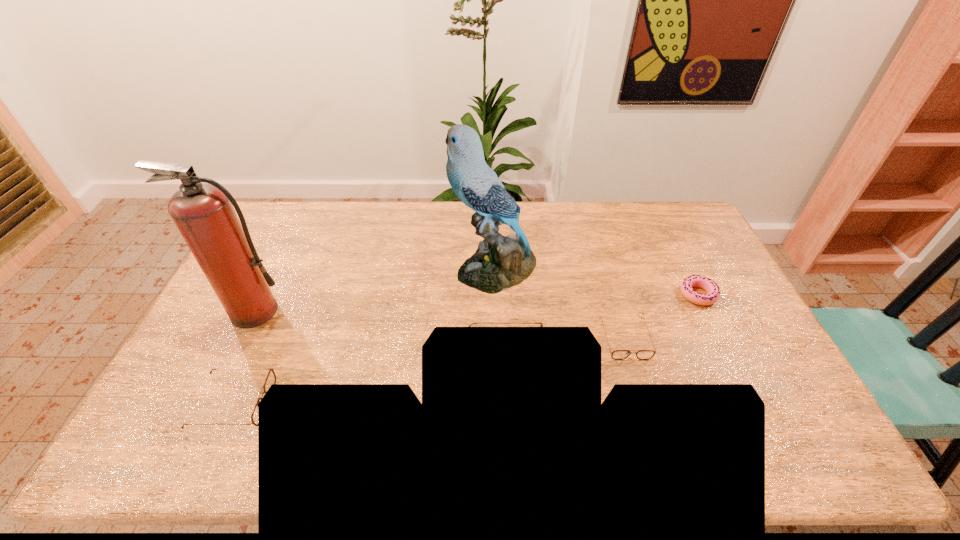
The height and width of the screenshot is (540, 960). Find the location of `vacant space that satisfies the following two spatial constraints: 1. on the front-facing side of the rightmost sunglasses; 2. on the front-facing side of the leftmost sunglasses`. vacant space that satisfies the following two spatial constraints: 1. on the front-facing side of the rightmost sunglasses; 2. on the front-facing side of the leftmost sunglasses is located at coordinates (644, 403).

Locate an element on the screen. This screenshot has height=540, width=960. free location that satisfies the following two spatial constraints: 1. on the front-facing side of the rightmost sunglasses; 2. on the front-facing side of the second sunglasses from left to right is located at coordinates (631, 359).

You are a GUI agent. You are given a task and a screenshot of the screen. Output one action in this format:
    pyautogui.click(x=<x>, y=<y>)
    Task: Click on the blank area in the image that satisfies the following two spatial constraints: 1. on the front-facing side of the shortest sunglasses; 2. on the front-facing side of the tallest sunglasses
    Image resolution: width=960 pixels, height=540 pixels.
    Given the screenshot: What is the action you would take?
    pyautogui.click(x=631, y=359)

Locate an element on the screen. free location that satisfies the following two spatial constraints: 1. on the face of the parakeet; 2. at the nozzle of the fire extinguisher is located at coordinates (496, 311).

I want to click on free space that satisfies the following two spatial constraints: 1. on the face of the parakeet; 2. at the nozzle of the fire extinguisher, so click(x=496, y=311).